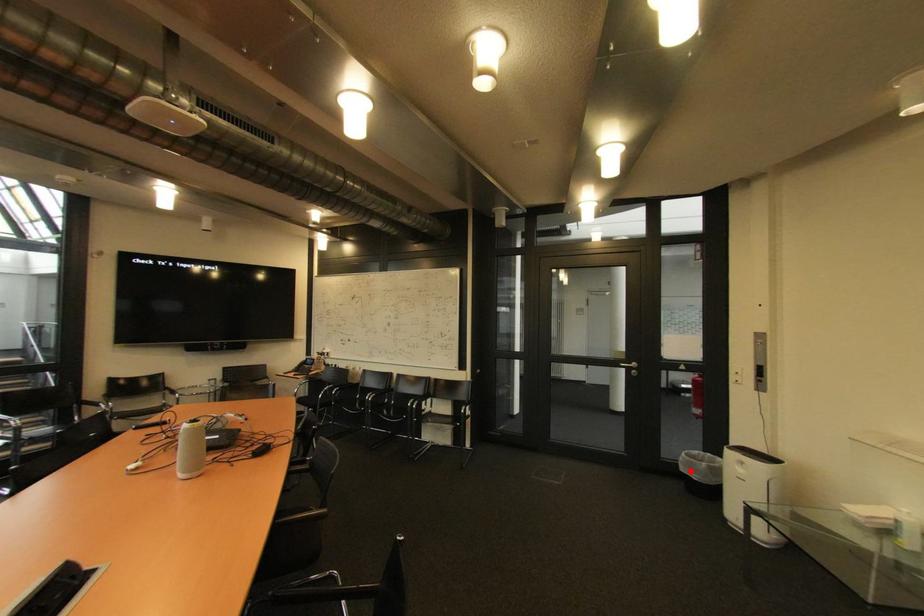
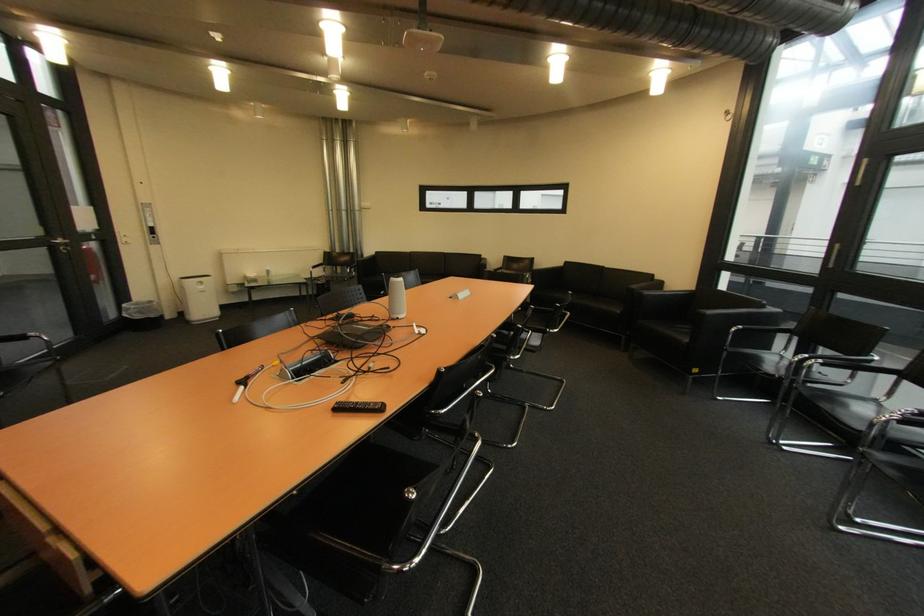
Locate, in the second image, the point that corresponds to the highlighted location in the first image.

(147, 318)